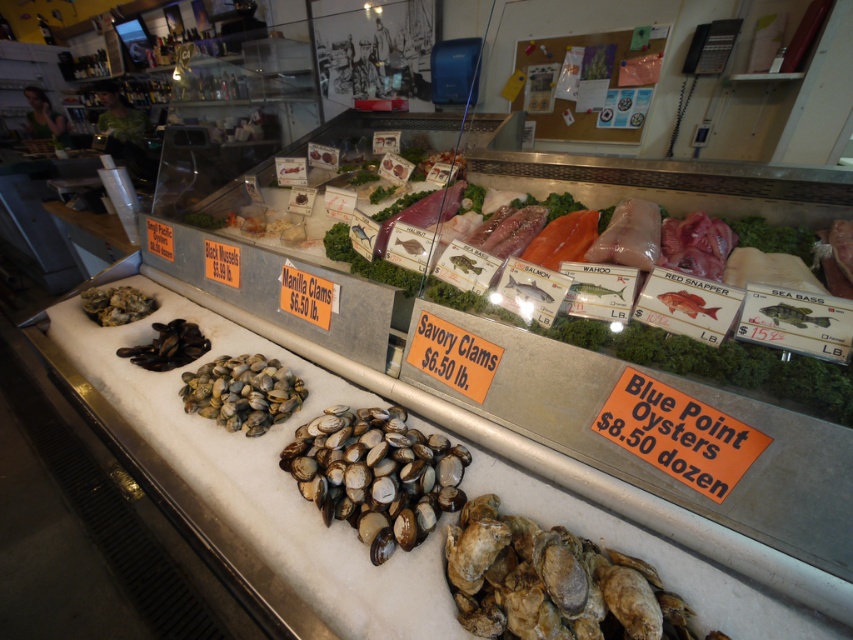
Question: Among these objects, which one is farthest from the camera?

Choices:
 (A) shiny brown shells at left
 (B) brown matte oyster at lower right
 (C) white glossy clam at center
 (D) black matte mussels at center

Answer: (A)

Question: Is brown matte clams at center thinner than black matte mussels at center?

Choices:
 (A) no
 (B) yes

Answer: (A)

Question: Which object is positioned closest to the brown matte clams at center?

Choices:
 (A) white glossy clam at center
 (B) brown matte oyster at lower right
 (C) shiny brown shells at left

Answer: (A)

Question: Which of the following is the closest to the observer?

Choices:
 (A) (202, 344)
 (B) (270, 401)

Answer: (B)

Question: Does black matte mussels at center have a smaller size compared to shiny brown shells at left?

Choices:
 (A) yes
 (B) no

Answer: (A)

Question: Is brown matte clams at center in front of black matte mussels at center?

Choices:
 (A) yes
 (B) no

Answer: (A)